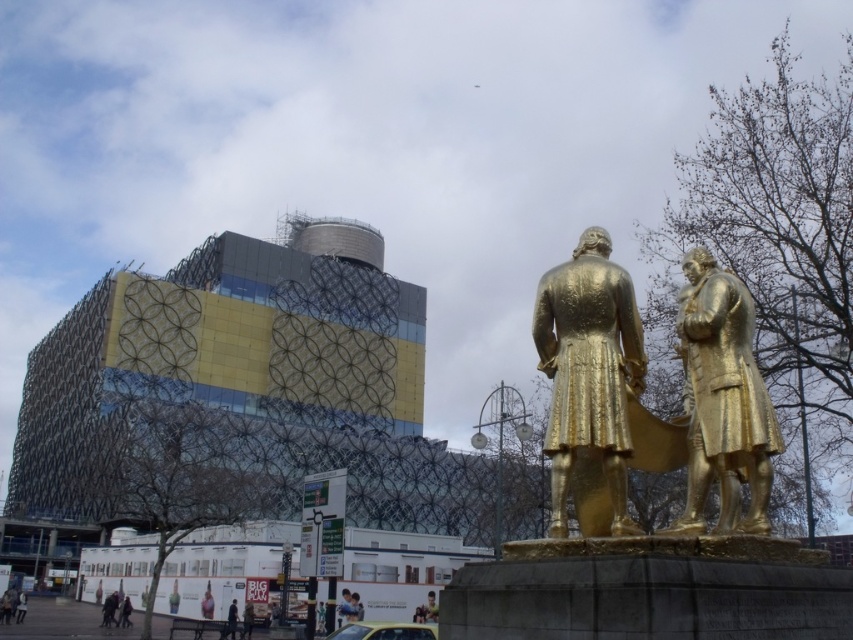
From the picture: You are a photographer planning to capture a closeup shot of the smooth pink dress at lower center. You need to ensure the light brown wooden bench at lower center doesn

The light brown wooden bench at lower center has a lesser width compared to the smooth pink dress at lower center. Therefore, the bench will not block the dress in your closeup shot as it is narrower.

You are standing at the center of the image and want to locate the gold metallic statue at center. According to the coordinates provided, in which direction should you look to find it?

The gold metallic statue at center is located at coordinates point (589,371). Since you are at the center of the image, you should look slightly to the right and downward to find it.